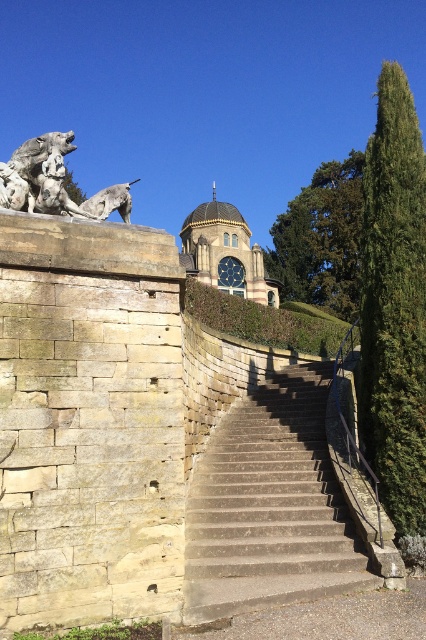
Question: Among these points, which one is nearest to the camera?

Choices:
 (A) 28,172
 (B) 239,266
 (C) 219,209

Answer: (A)

Question: Is concrete stairs at center to the left of green leafy hedge at center from the viewer's perspective?

Choices:
 (A) yes
 (B) no

Answer: (A)

Question: Which point is closer to the camera taking this photo?

Choices:
 (A) (127, 182)
 (B) (210, 216)

Answer: (A)

Question: Estimate the real-world distances between objects in this image. Which object is farther from the green leafy hedge at upper center?

Choices:
 (A) green leafy hedge at center
 (B) gold metallic clock at center

Answer: (A)

Question: Can you confirm if stone statue at upper left is positioned below gold metallic clock at center?

Choices:
 (A) no
 (B) yes

Answer: (A)

Question: Is green leafy hedge at upper center smaller than green leafy hedge at center?

Choices:
 (A) yes
 (B) no

Answer: (B)